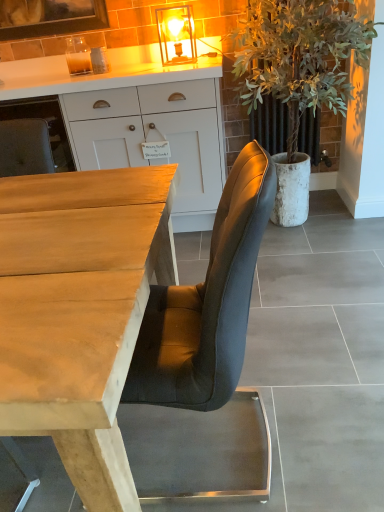
Question: Does point (195, 97) appear closer or farther from the camera than point (292, 340)?

Choices:
 (A) closer
 (B) farther

Answer: (B)

Question: Relative to smooth gray concrete at center, is white matte cabinet at upper center in front or behind?

Choices:
 (A) behind
 (B) front

Answer: (A)

Question: Which of these objects is positioned closest to the white matte cabinet at upper center?

Choices:
 (A) smooth gray concrete at center
 (B) wooden desk at center
 (C) green leafy plant at right

Answer: (C)

Question: Considering the real-world distances, which object is closest to the white matte cabinet at upper center?

Choices:
 (A) green leafy plant at right
 (B) smooth gray concrete at center
 (C) wooden desk at center

Answer: (A)